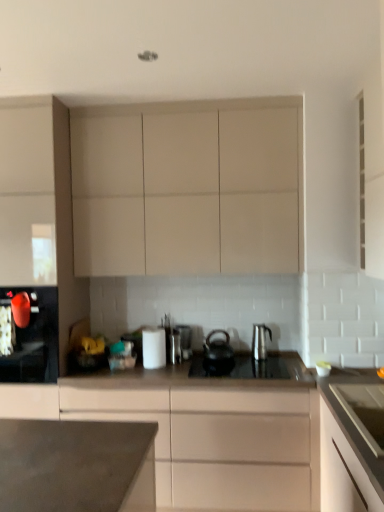
Question: From a real-world perspective, is matte white cabinet at left, the 1th cabinetry from the left, below satin silver kettle at center, marked as the 1th kitchen appliance in a right-to-left arrangement?

Choices:
 (A) no
 (B) yes

Answer: (A)

Question: Is matte white cabinet at left, which is counted as the 4th cabinetry, starting from the right, further to the viewer compared to satin silver kettle at center, the 3th kitchen appliance in the left-to-right sequence?

Choices:
 (A) no
 (B) yes

Answer: (A)

Question: Is matte white cabinet at left, the 1th cabinetry from the left, outside of satin silver kettle at center, marked as the 1th kitchen appliance in a right-to-left arrangement?

Choices:
 (A) yes
 (B) no

Answer: (A)

Question: From the image's perspective, does matte white cabinet at left, the 1th cabinetry from the left, appear higher than satin silver kettle at center, the 3th kitchen appliance in the left-to-right sequence?

Choices:
 (A) no
 (B) yes

Answer: (B)

Question: Does matte white cabinet at left, the 1th cabinetry from the left, contain satin silver kettle at center, marked as the 1th kitchen appliance in a right-to-left arrangement?

Choices:
 (A) yes
 (B) no

Answer: (B)

Question: In the image, is matte beige cabinet at center, placed as the 3th cabinetry when sorted from left to right, positioned in front of or behind white matte cabinet at right, placed as the fourth cabinetry when sorted from left to right?

Choices:
 (A) front
 (B) behind

Answer: (A)

Question: From a real-world perspective, is matte beige cabinet at center, which is the second cabinetry from right to left, physically located above or below white matte cabinet at right, arranged as the 1th cabinetry when viewed from the right?

Choices:
 (A) below
 (B) above

Answer: (A)

Question: In terms of size, does matte beige cabinet at center, placed as the 3th cabinetry when sorted from left to right, appear bigger or smaller than white matte cabinet at right, placed as the fourth cabinetry when sorted from left to right?

Choices:
 (A) small
 (B) big

Answer: (B)

Question: Considering the positions of point (284, 381) and point (336, 452), is point (284, 381) closer or farther from the camera than point (336, 452)?

Choices:
 (A) closer
 (B) farther

Answer: (B)

Question: Considering the positions of point (213, 232) and point (362, 481), is point (213, 232) closer or farther from the camera than point (362, 481)?

Choices:
 (A) closer
 (B) farther

Answer: (B)

Question: In the image, is matte beige cabinet at upper center, marked as the second cabinetry in a left-to-right arrangement, on the left side or the right side of white matte cabinet at right, arranged as the 1th cabinetry when viewed from the right?

Choices:
 (A) left
 (B) right

Answer: (A)

Question: In terms of width, does matte beige cabinet at upper center, placed as the 3th cabinetry when sorted from right to left, look wider or thinner when compared to white matte cabinet at right, placed as the fourth cabinetry when sorted from left to right?

Choices:
 (A) wide
 (B) thin

Answer: (A)

Question: Is matte beige cabinet at upper center, marked as the second cabinetry in a left-to-right arrangement, in front of or behind white matte cabinet at right, arranged as the 1th cabinetry when viewed from the right, in the image?

Choices:
 (A) front
 (B) behind

Answer: (B)

Question: Based on their positions, is matte beige cabinet at center, which is the second cabinetry from right to left, located to the left or right of matte black kettle at left, the 3th kitchen appliance from the right?

Choices:
 (A) right
 (B) left

Answer: (A)

Question: Is matte beige cabinet at center, placed as the 3th cabinetry when sorted from left to right, taller or shorter than matte black kettle at left, marked as the first kitchen appliance in a left-to-right arrangement?

Choices:
 (A) tall
 (B) short

Answer: (A)